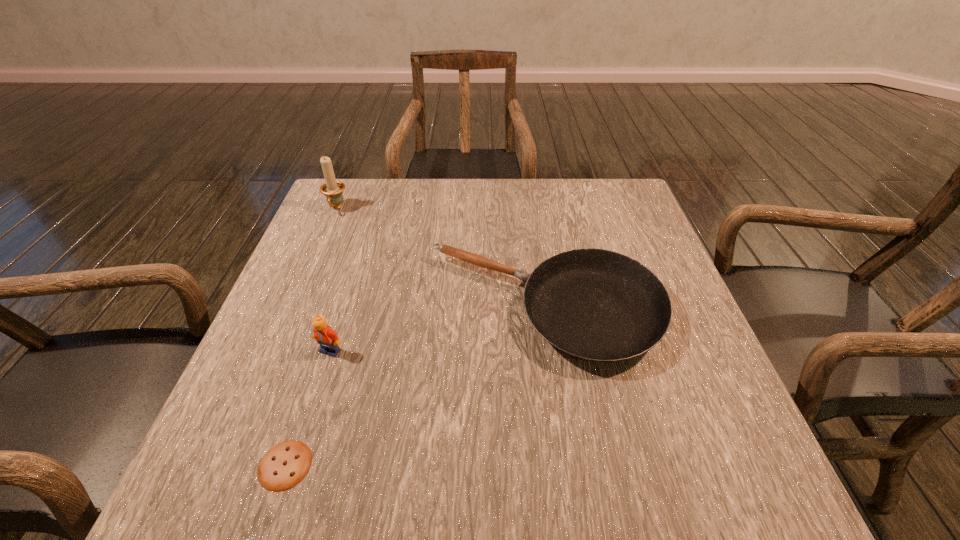
At what (x,y) coordinates should I click in order to perform the action: click on free space located 0.310m on the right of the nearest object. Please return your answer as a coordinate pair (x, y). Looking at the image, I should click on (508, 465).

Identify the location of object situated at the far edge. (332, 189).

Image resolution: width=960 pixels, height=540 pixels. I want to click on object located at the near edge, so click(x=286, y=464).

The width and height of the screenshot is (960, 540). Find the location of `candle_holder that is at the left edge`. candle_holder that is at the left edge is located at coordinates (332, 189).

Identify the location of Lego that is at the left edge. coord(328,339).

Locate an element on the screen. cookie that is at the left edge is located at coordinates (286, 464).

Find the location of `object present at the right edge`. object present at the right edge is located at coordinates (599, 305).

What are the coordinates of `object located in the far left corner section of the desktop` in the screenshot? It's located at (332, 189).

The width and height of the screenshot is (960, 540). I want to click on object present at the near left corner, so click(x=286, y=464).

Locate an element on the screen. The image size is (960, 540). free space at the far edge is located at coordinates (435, 200).